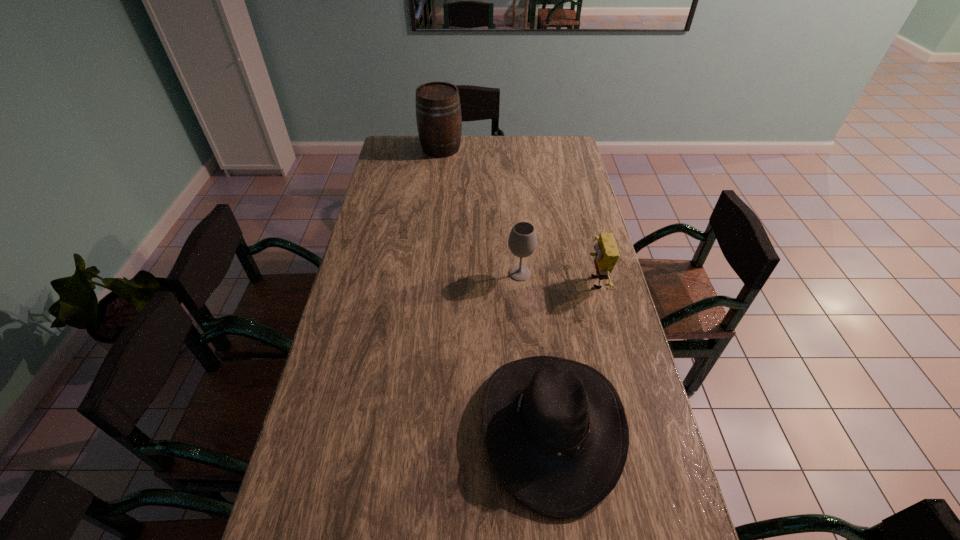
Where is `free space at the right edge`? The width and height of the screenshot is (960, 540). free space at the right edge is located at coordinates coord(640,404).

The width and height of the screenshot is (960, 540). What are the coordinates of `free region at the far right corner of the desktop` in the screenshot? It's located at (554, 143).

Where is `free spot between the tallest object and the sponge`? free spot between the tallest object and the sponge is located at coordinates (517, 215).

Identify the location of vacant region between the sponge and the nearest object. (573, 355).

Locate an element on the screen. This screenshot has height=540, width=960. free point between the sponge and the nearest object is located at coordinates (573, 355).

Where is `blank region between the sponge and the tallest object`? blank region between the sponge and the tallest object is located at coordinates (517, 215).

Identify the location of empty space that is in between the sponge and the cider. (517, 215).

This screenshot has height=540, width=960. Identify the location of unoccupied area between the cowboy hat and the wineglass. (536, 350).

Locate an element on the screen. the third closest object relative to the cider is located at coordinates (556, 431).

Find the location of `object that is the closest to the wineglass`. object that is the closest to the wineglass is located at coordinates (606, 256).